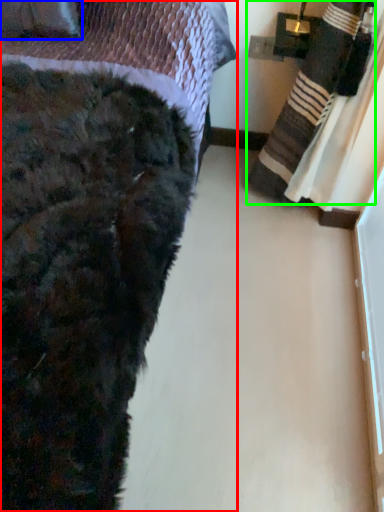
Question: Which object is positioned closest to bed (highlighted by a red box)? Select from throw pillow (highlighted by a blue box) and blanket (highlighted by a green box).

Choices:
 (A) throw pillow
 (B) blanket

Answer: (A)